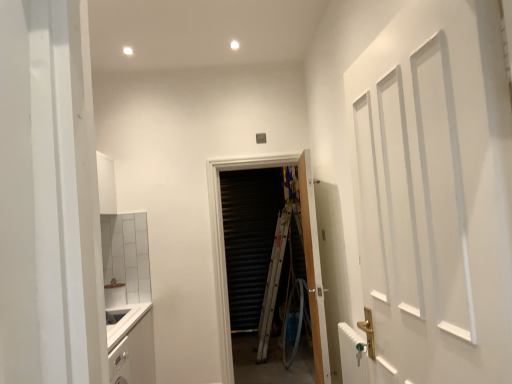
Question: Is white metallic radiator at lower right at the left side of wooden door at center, marked as the first door in a back-to-front arrangement?

Choices:
 (A) yes
 (B) no

Answer: (B)

Question: Is white metallic radiator at lower right to the right of wooden door at center, the third door in the front-to-back sequence, from the viewer's perspective?

Choices:
 (A) no
 (B) yes

Answer: (B)

Question: Can you confirm if white metallic radiator at lower right is taller than wooden door at center, the third door in the front-to-back sequence?

Choices:
 (A) no
 (B) yes

Answer: (A)

Question: Is white metallic radiator at lower right positioned behind wooden door at center, the third door in the front-to-back sequence?

Choices:
 (A) no
 (B) yes

Answer: (A)

Question: Considering the relative sizes of white metallic radiator at lower right and wooden door at center, the third door in the front-to-back sequence, in the image provided, is white metallic radiator at lower right bigger than wooden door at center, the third door in the front-to-back sequence,?

Choices:
 (A) no
 (B) yes

Answer: (A)

Question: Is point (313, 281) closer or farther from the camera than point (344, 324)?

Choices:
 (A) closer
 (B) farther

Answer: (B)

Question: From a real-world perspective, is wooden door at center, the second door viewed from the front, physically located above or below white metallic radiator at lower right?

Choices:
 (A) above
 (B) below

Answer: (A)

Question: Looking at their shapes, would you say wooden door at center, the second door viewed from the front, is wider or thinner than white metallic radiator at lower right?

Choices:
 (A) wide
 (B) thin

Answer: (A)

Question: Visually, is wooden door at center, the second door viewed from the front, positioned to the left or to the right of white metallic radiator at lower right?

Choices:
 (A) left
 (B) right

Answer: (A)

Question: Is wooden door at center, the second door viewed from the front, to the left or to the right of white matte door at right, marked as the 3th door in a back-to-front arrangement, in the image?

Choices:
 (A) right
 (B) left

Answer: (A)

Question: Considering the positions of wooden door at center, the second door viewed from the front, and white matte door at right, the 1th door from the front, in the image, is wooden door at center, the second door viewed from the front, taller or shorter than white matte door at right, the 1th door from the front,?

Choices:
 (A) tall
 (B) short

Answer: (A)

Question: In terms of width, does wooden door at center, the second door viewed from the front, look wider or thinner when compared to white matte door at right, the 1th door from the front?

Choices:
 (A) wide
 (B) thin

Answer: (B)

Question: From a real-world perspective, relative to white matte door at right, the 1th door from the front, is wooden door at center, the second door viewed from the front, vertically above or below?

Choices:
 (A) below
 (B) above

Answer: (A)

Question: Considering the positions of white matte cabinet at lower left and wooden door at center, the second door viewed from the front, in the image, is white matte cabinet at lower left wider or thinner than wooden door at center, the second door viewed from the front,?

Choices:
 (A) wide
 (B) thin

Answer: (A)

Question: Is point (118, 354) closer or farther from the camera than point (311, 226)?

Choices:
 (A) farther
 (B) closer

Answer: (B)